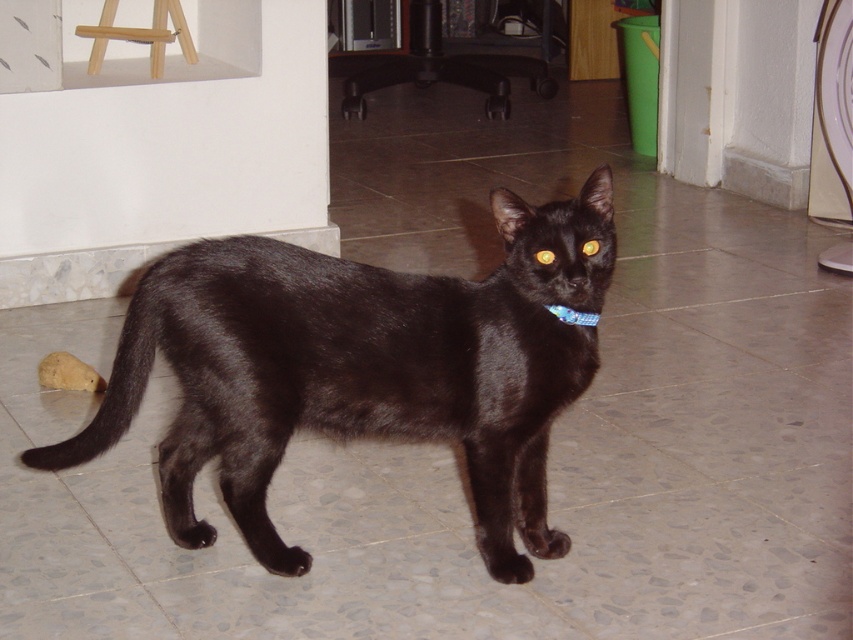
Question: Is shiny black cat at center positioned behind yellow shiny eye at center?

Choices:
 (A) no
 (B) yes

Answer: (A)

Question: Can you confirm if shiny black cat at center is positioned to the right of yellow shiny eye at center?

Choices:
 (A) no
 (B) yes

Answer: (A)

Question: Is light brown wooden stool at upper left further to the viewer compared to blue fabric neckband at center?

Choices:
 (A) yes
 (B) no

Answer: (A)

Question: Which point is closer to the camera taking this photo?

Choices:
 (A) (543, 259)
 (B) (218, 440)
 (C) (596, 250)
 (D) (560, 316)

Answer: (A)

Question: Which point is closer to the camera?

Choices:
 (A) (184, 40)
 (B) (583, 253)
 (C) (538, 250)

Answer: (B)

Question: Which point appears farthest from the camera in this image?

Choices:
 (A) (538, 260)
 (B) (592, 323)
 (C) (469, 358)

Answer: (B)